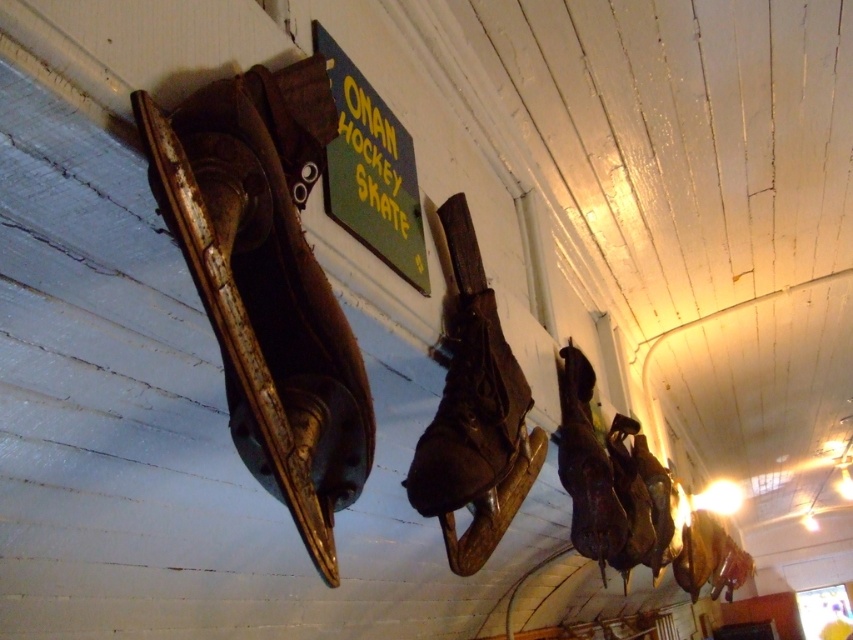
Question: Which point is farther from the camera taking this photo?

Choices:
 (A) (485, 326)
 (B) (271, 467)

Answer: (A)

Question: Which point is closer to the camera?

Choices:
 (A) brown leather skate at center
 (B) leather at left

Answer: (B)

Question: Is leather at left closer to camera compared to brown leather skate at center?

Choices:
 (A) no
 (B) yes

Answer: (B)

Question: Which point appears closest to the camera in this image?

Choices:
 (A) (451, 384)
 (B) (165, 188)

Answer: (B)

Question: Does leather at left have a smaller size compared to brown leather skate at center?

Choices:
 (A) no
 (B) yes

Answer: (A)

Question: Is leather at left positioned in front of brown leather skate at center?

Choices:
 (A) yes
 (B) no

Answer: (A)